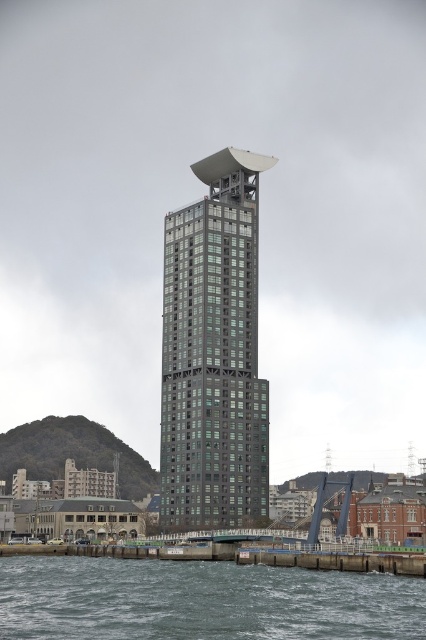
You are standing at the edge of the waterfront near the transparent water at lower center. If you look directly ahead, which direction would the tall, slender building with the circular top be located relative to you?

The tall, slender building with the circular top is located behind the transparent water at lower center, so it would be behind you if you are facing the water.